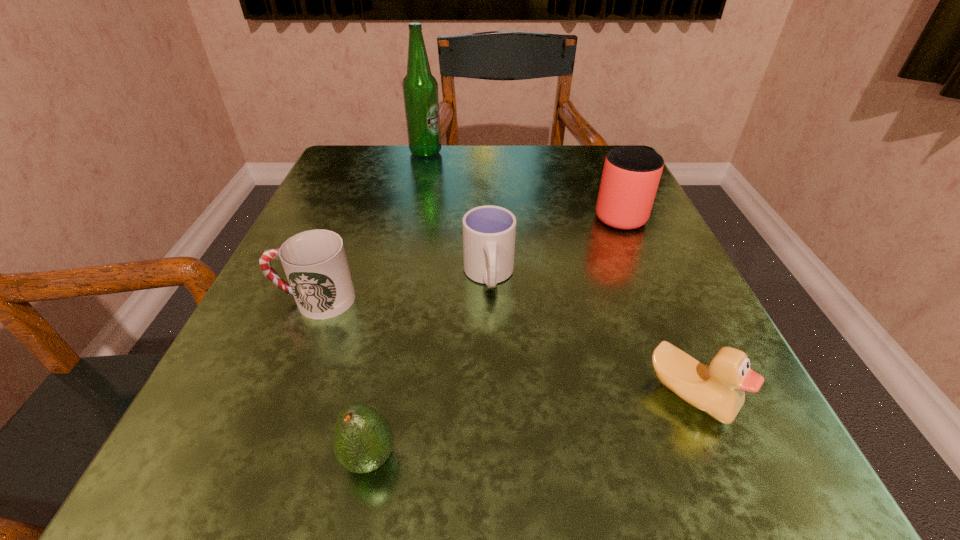
The image size is (960, 540). I want to click on beer bottle, so click(420, 89).

Where is `the tallest object`? the tallest object is located at coordinates (420, 89).

At what (x,y) coordinates should I click in order to perform the action: click on the fifth nearest object. Please return your answer as a coordinate pair (x, y). Looking at the image, I should click on (631, 174).

The width and height of the screenshot is (960, 540). Find the location of `the second tallest object`. the second tallest object is located at coordinates (631, 174).

Identify the location of the leftmost object. The image size is (960, 540). (315, 263).

Where is `the second cup from left to right`? This screenshot has height=540, width=960. the second cup from left to right is located at coordinates (489, 232).

This screenshot has height=540, width=960. Find the location of `the fifth farthest object`. the fifth farthest object is located at coordinates (718, 390).

Locate an element on the screen. the nearest object is located at coordinates (363, 440).

I want to click on free space located 0.120m on the label of the farthest object, so [x=493, y=153].

Locate an element on the screen. The image size is (960, 540). vacant area situated on the handle side of the farthest cup is located at coordinates (599, 168).